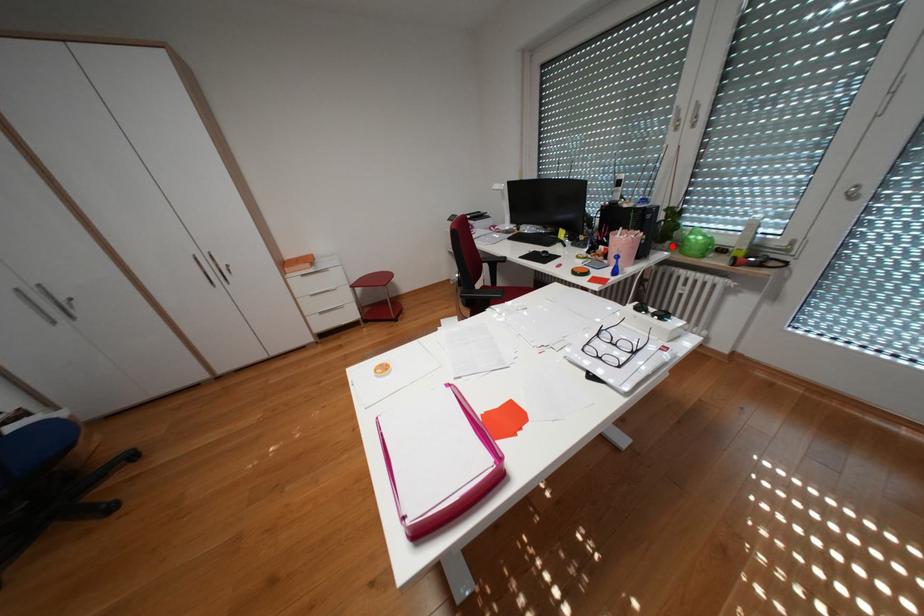
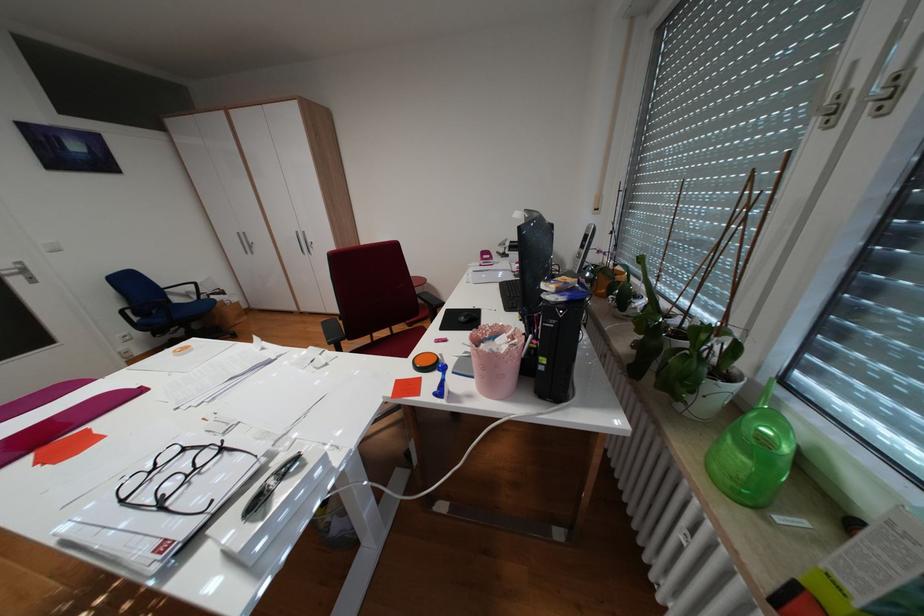
Locate, in the second image, the point that corresponds to the highlighted location in the first image.

(691, 405)